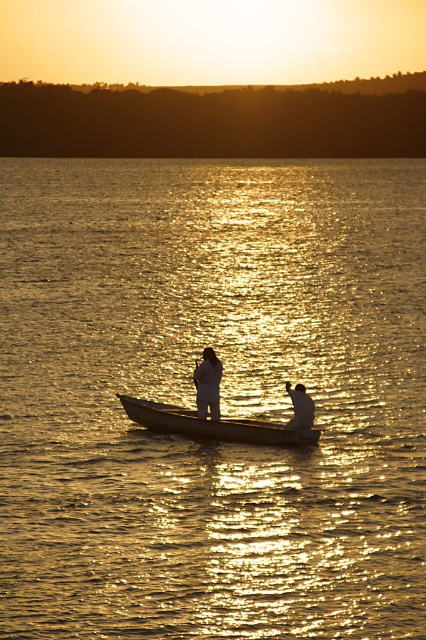
Looking at this image, you are a photographer trying to capture the reflection of the sunset in the shiny golden water at center. Based on the scene description, where should you position your camera to ensure the reflection is centered in your shot?

The shiny golden water at center is located at point 2D coordinates of (221, 400). To center the reflection in your shot, position your camera directly above this point, ensuring the lens is aligned with the coordinates (221, 400).

You are standing at the edge of the water and want to see both the shiny golden water at center and the wooden paddle at center. Which one appears taller from your viewpoint?

The shiny golden water at center appears much taller than the wooden paddle at center from your viewpoint.

You are standing on a boat and see the wooden paddle at center in the water. If you want to reach it without getting wet, what is the minimum distance you need to move towards it?

The wooden paddle at center is 79.28 feet away from viewer. To reach it without getting wet, you need to move at least 79.28 feet towards it.